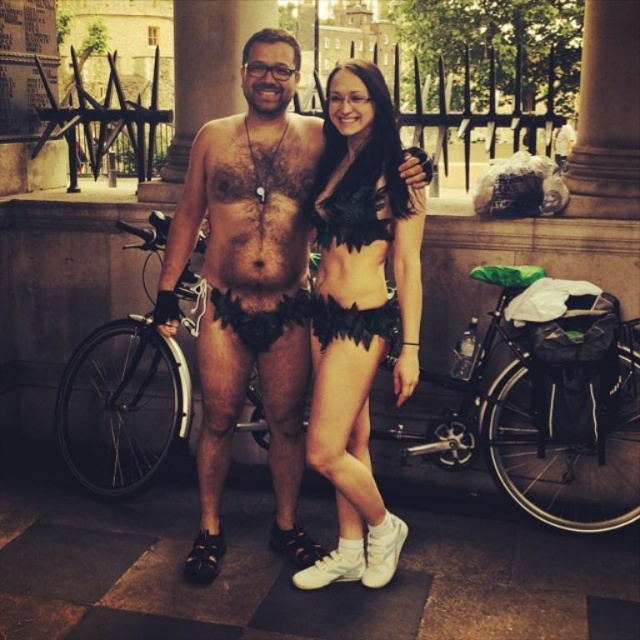
Based on the photo, who is higher up, leather shorts at center or black feathered bikini top at center?

black feathered bikini top at center is higher up.

Can you confirm if leather shorts at center is positioned to the right of black feathered bikini top at center?

No, leather shorts at center is not to the right of black feathered bikini top at center.

Which is behind, point (276, 544) or point (339, 161)?

Positioned behind is point (339, 161).

Where is `leather shorts at center`? leather shorts at center is located at coordinates (250, 285).

Does point (353, 237) come farther from viewer compared to point (380, 232)?

Yes.

Who is higher up, black matte leafy bikini at center or black feathered bikini top at center?

Positioned higher is black feathered bikini top at center.

Does point (422, 198) come in front of point (374, 234)?

Yes.

Where is `black matte leafy bikini at center`? This screenshot has width=640, height=640. black matte leafy bikini at center is located at coordinates (358, 316).

Is the position of leather shorts at center more distant than that of black matte leafy bikini at center?

No.

Does leather shorts at center appear under black matte leafy bikini at center?

No.

The width and height of the screenshot is (640, 640). Describe the element at coordinates (250, 285) in the screenshot. I see `leather shorts at center` at that location.

At what (x,y) coordinates should I click in order to perform the action: click on leather shorts at center. Please return your answer as a coordinate pair (x, y). Looking at the image, I should click on (x=250, y=285).